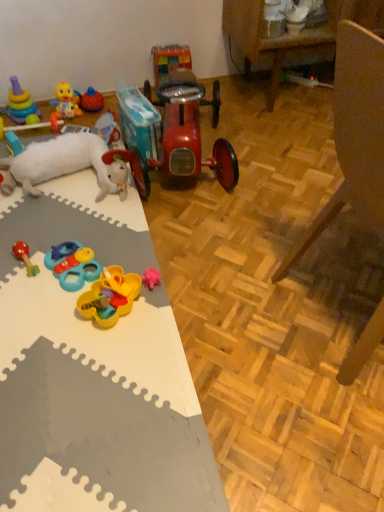
I want to click on free space between yellow plastic toy at center, arranged as the 3th toy when viewed from the right, and white plush sheep at left, which ranks as the 7th toy in right-to-left order, so click(89, 231).